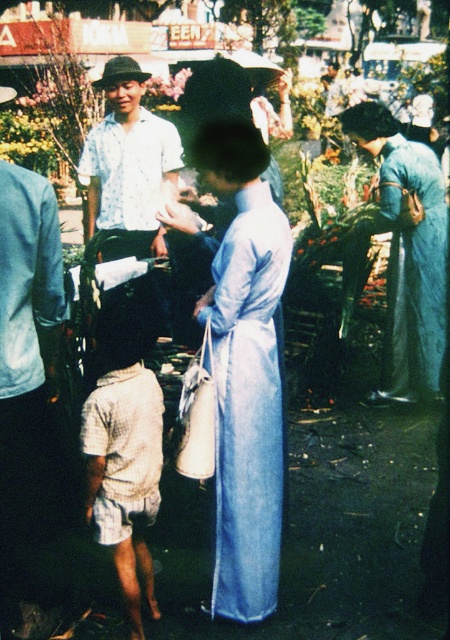
Question: Does white checkered shorts at lower left have a larger size compared to light blue shirt at center?

Choices:
 (A) yes
 (B) no

Answer: (B)

Question: Among these objects, which one is farthest from the camera?

Choices:
 (A) light blue shirt at center
 (B) light blue silk ao dai at center

Answer: (A)

Question: Estimate the real-world distances between objects in this image. Which object is closer to the white checkered shorts at lower left?

Choices:
 (A) light blue shirt at center
 (B) light blue silk ao dai at center

Answer: (B)

Question: Among these objects, which one is nearest to the camera?

Choices:
 (A) white checkered shorts at lower left
 (B) light blue silk ao dai at center

Answer: (A)

Question: In this image, where is white checkered shorts at lower left located relative to light blue shirt at center?

Choices:
 (A) left
 (B) right

Answer: (B)

Question: Does light blue silk ao dai at center appear on the right side of white checkered shorts at lower left?

Choices:
 (A) no
 (B) yes

Answer: (B)